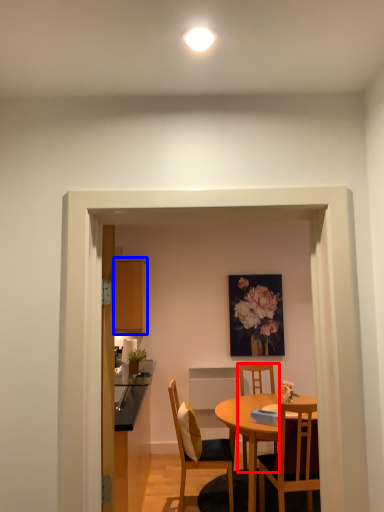
Question: Among these objects, which one is farthest to the camera, chair (highlighted by a red box) or cabinetry (highlighted by a blue box)?

Choices:
 (A) chair
 (B) cabinetry

Answer: (B)